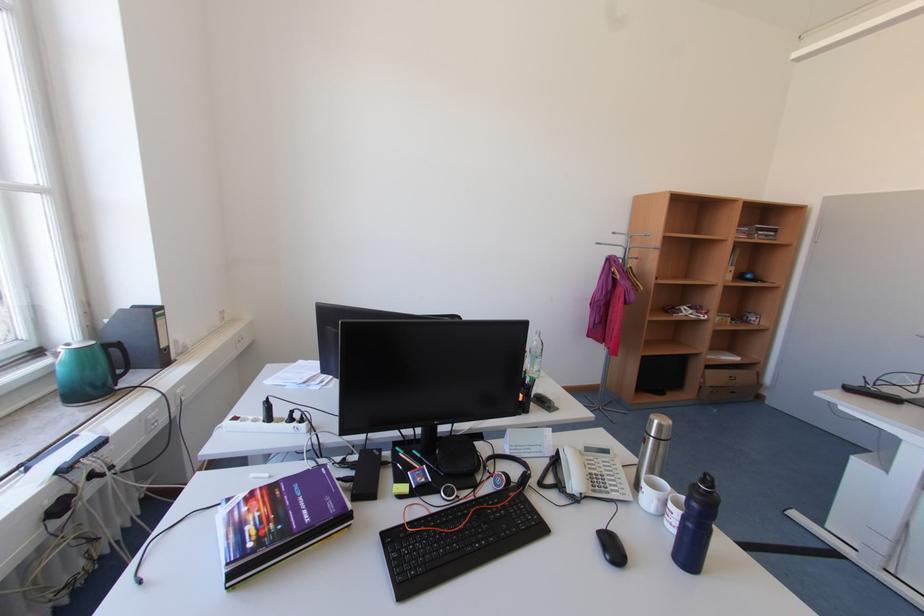
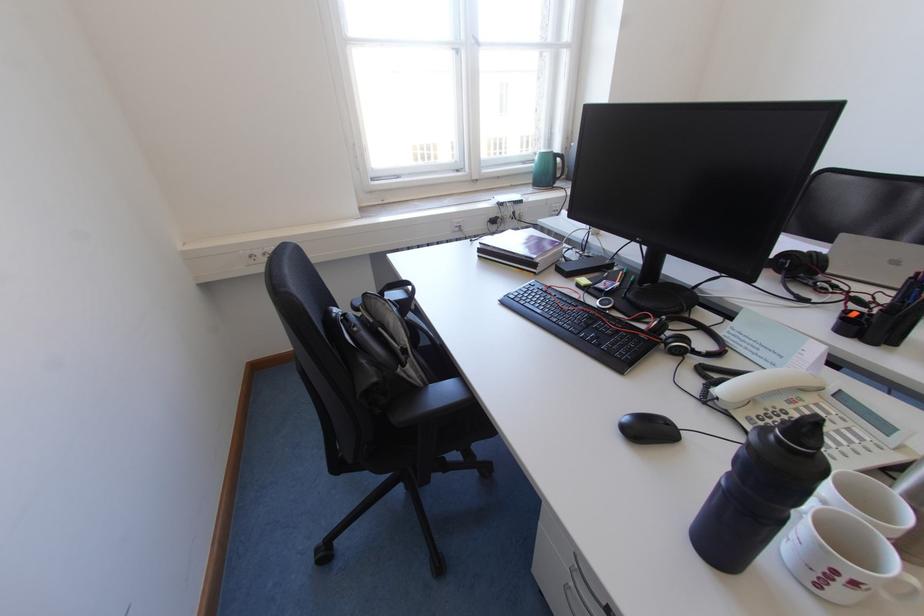
How did the camera likely rotate?

The camera's rotation is toward left-down.